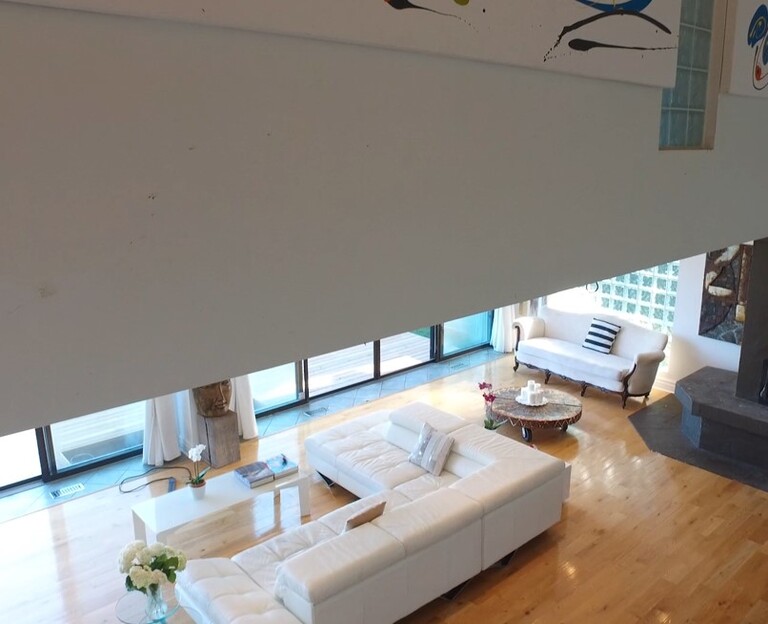
Identify the location of window. (465, 336), (418, 344), (345, 364), (276, 396), (106, 430), (21, 462).